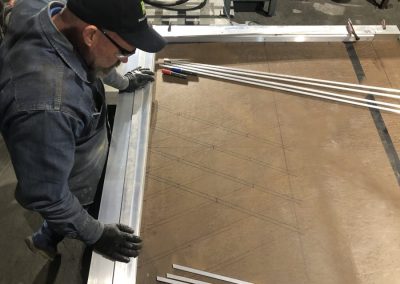
Where is `wooden board`? This screenshot has height=284, width=400. wooden board is located at coordinates (304, 168).